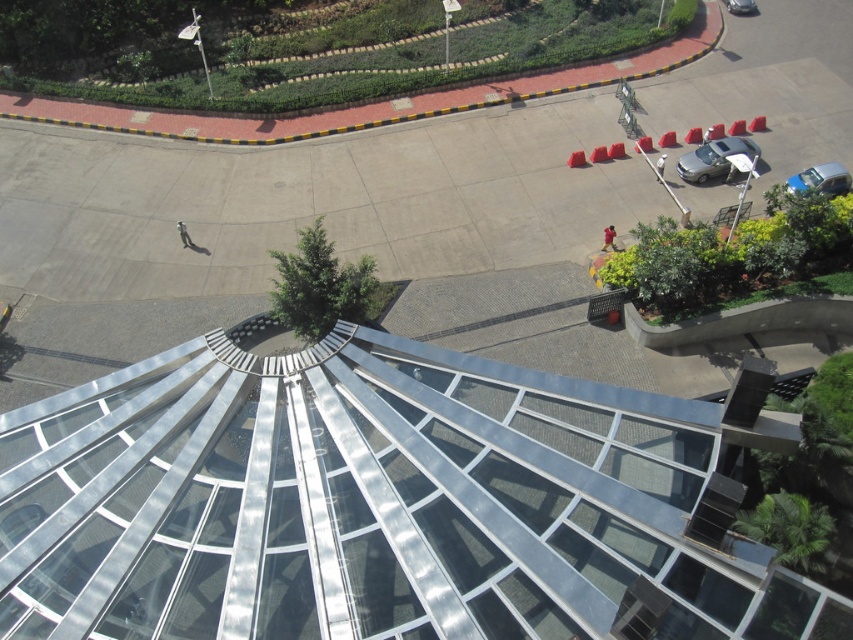
You are a parking attendant and need to fit both the satin silver sedan at right and the silver metallic car at upper right into a parking spot that is 2 meters wide. Based on the scene, can both cars fit side by one?

The satin silver sedan at right is wider than the silver metallic car at upper right. Since the parking spot is only 2 meters wide, and the sedan alone is already wider than the car, it is unlikely both can fit side by side without overlapping.

You are a visitor standing at the entrance of the plaza. You see the metallic glass pyramid at center and the silver metallic car at upper right. Which object is bigger in size?

The metallic glass pyramid at center is larger in size than the silver metallic car at upper right.

You are standing at the center of the aerial view of the modern architectural structure. There are two points marked as point 1 at coordinates point (740, 152) and point 2 at coordinates point (749, 1). Which point is closer to your current position?

Point (740, 152) is closer to the camera than point (749, 1), so it is closer to your current position.